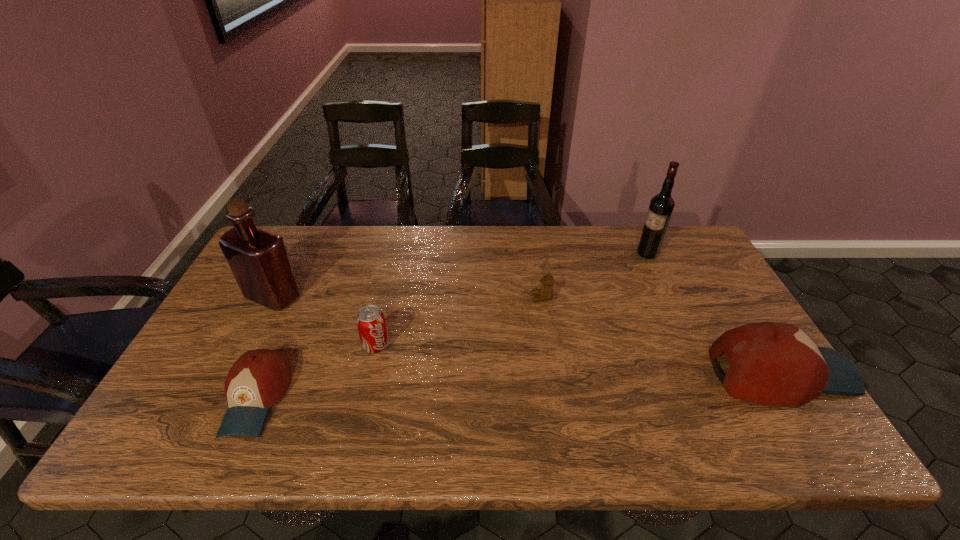
Find the location of a particular element. Image resolution: width=960 pixels, height=540 pixels. object identified as the closest to the farthest object is located at coordinates (546, 292).

You are a GUI agent. You are given a task and a screenshot of the screen. Output one action in this format:
    pyautogui.click(x=<x>, y=<y>)
    Task: Click on the free space that satisfies the following two spatial constraints: 1. on the front-facing side of the fourth object from left to right; 2. on the front-facing side of the shorter baseball cap
    
    Given the screenshot: What is the action you would take?
    pyautogui.click(x=558, y=399)

What are the coordinates of `vacant space that satisfies the following two spatial constraints: 1. on the front and back of the wine bottle; 2. on the front-facing side of the left baseball cap` in the screenshot? It's located at (714, 399).

In order to click on blank area in the image that satisfies the following two spatial constraints: 1. on the front and back of the farthest object; 2. on the front-facing side of the left baseball cap in this screenshot , I will do `click(714, 399)`.